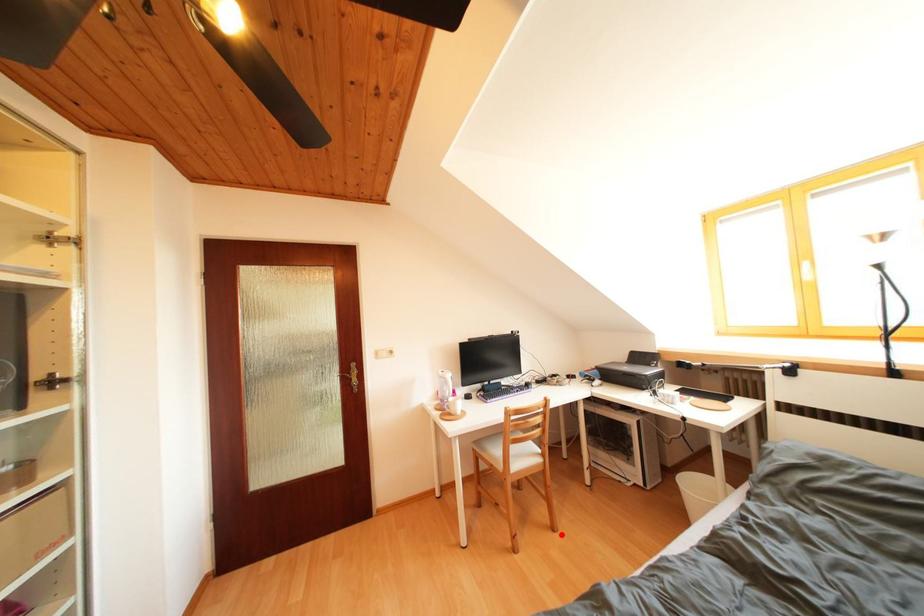
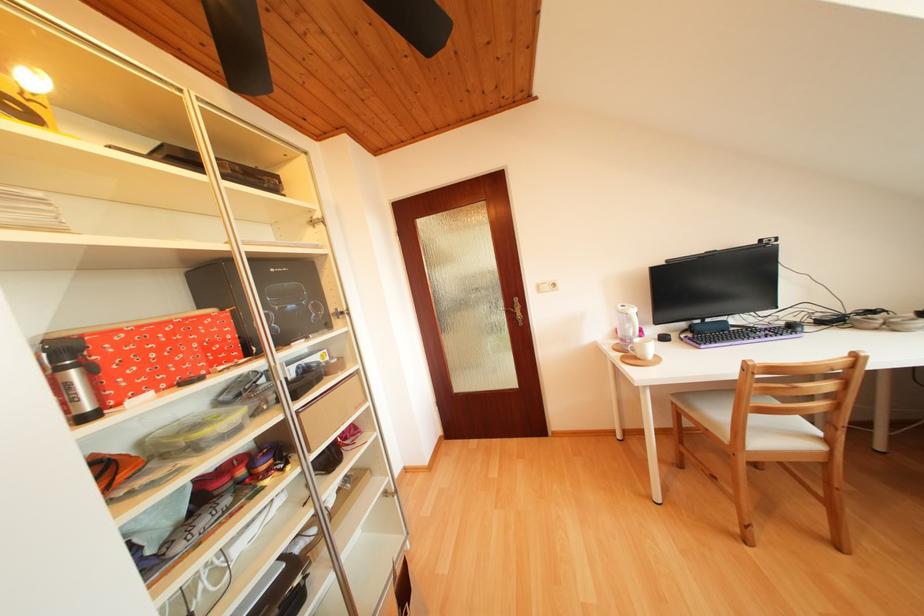
Locate, in the second image, the point that corresponds to the highlighted location in the first image.

(847, 553)